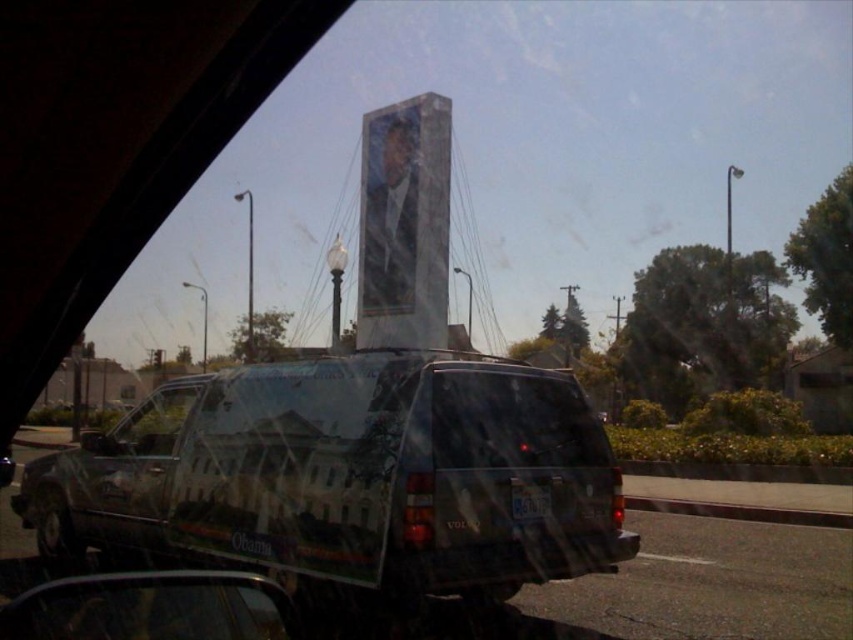
You are a passenger in a car and want to see the billboard outside clearly. Which object, the transparent plastic car window at center or the metallic reflective view mirror at lower left, would allow you to view the billboard more clearly?

The transparent plastic car window at center is taller than the metallic reflective view mirror at lower left, so the transparent plastic car window at center would allow you to view the billboard more clearly.

You are a passenger in the car and want to look outside through the transparent glass car window at lower center. Can you do so without moving your head, considering the position of the metallic reflective view mirror at lower left?

The transparent glass car window at lower center is in front of the metallic reflective view mirror at lower left, so you can look outside through the transparent glass car window at lower center without moving your head because it is positioned in front of the mirror.

You are a passenger in the metallic silver suv at center and want to check the license plate of the parked vehicle in front. Can you see the license plate through the transparent glass car window at lower center?

The metallic silver suv at center is bigger than transparent glass car window at lower center, so the passenger can see the license plate through the transparent glass car window at lower center as it is large enough to provide a clear view.